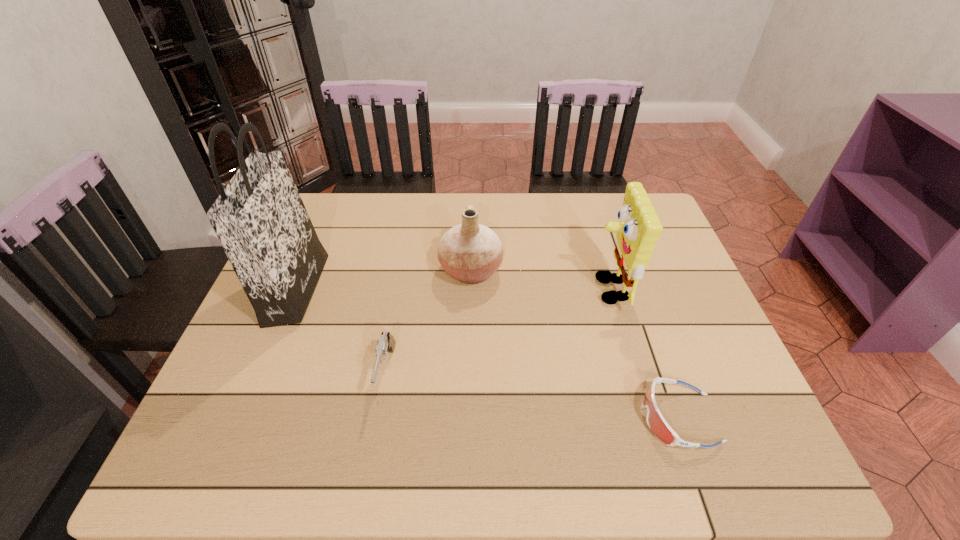
Find the location of `free space located on the face of the second tallest object`. free space located on the face of the second tallest object is located at coordinates (445, 289).

This screenshot has height=540, width=960. Identify the location of vacant space located on the face of the second tallest object. (544, 289).

Find the location of a particular element. The width and height of the screenshot is (960, 540). free space located 0.400m to pour from the handle of the third shortest object is located at coordinates (648, 271).

Locate an element on the screen. blank area located 0.110m at the muzzle of the gun is located at coordinates (371, 457).

Where is `vacant space located 0.300m on the front-facing side of the shortest object`? The height and width of the screenshot is (540, 960). vacant space located 0.300m on the front-facing side of the shortest object is located at coordinates (495, 418).

At what (x,y) coordinates should I click in order to perform the action: click on free space located on the front-facing side of the shortest object. Please return your answer as a coordinate pair (x, y). Looking at the image, I should click on (573, 418).

The image size is (960, 540). I want to click on free space located on the front-facing side of the shortest object, so click(x=505, y=418).

I want to click on object that is positioned at the near edge, so click(x=656, y=422).

At what (x,y) coordinates should I click in order to perform the action: click on object that is at the left edge. Please return your answer as a coordinate pair (x, y). Looking at the image, I should click on (259, 218).

Locate an element on the screen. The height and width of the screenshot is (540, 960). object positioned at the right edge is located at coordinates (656, 422).